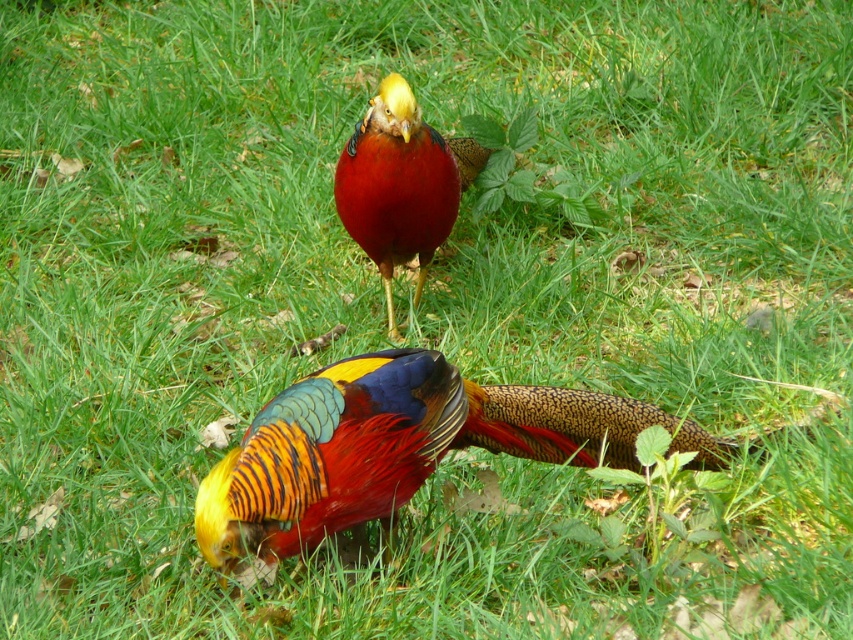
Is point (366, 372) farther from camera compared to point (375, 138)?

No, it is not.

Can you confirm if shiny multicolored bird at center is positioned below glossy red pheasant at center?

Correct, shiny multicolored bird at center is located below glossy red pheasant at center.

Is point (477, 440) farther from camera compared to point (427, 186)?

That is False.

Where is `shiny multicolored bird at center`? shiny multicolored bird at center is located at coordinates (401, 445).